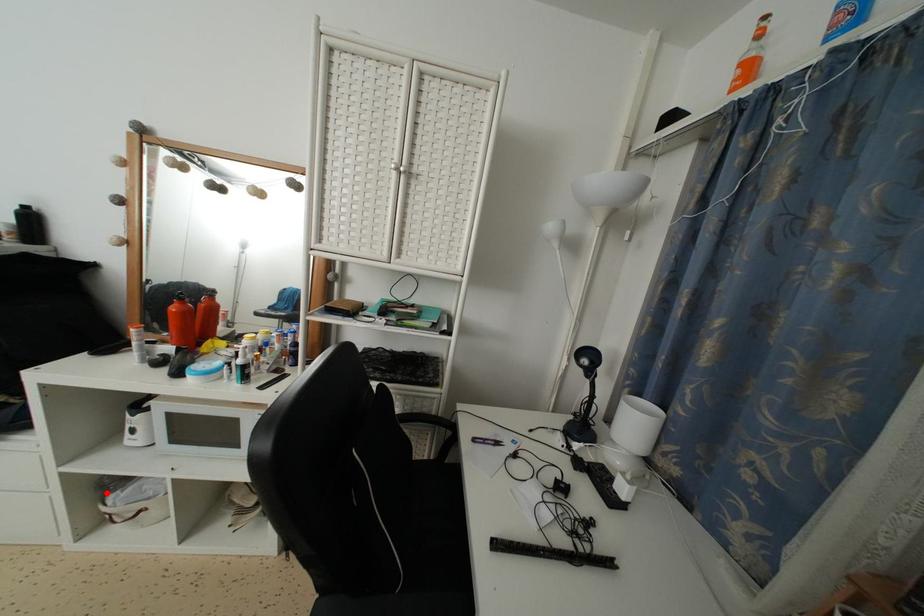
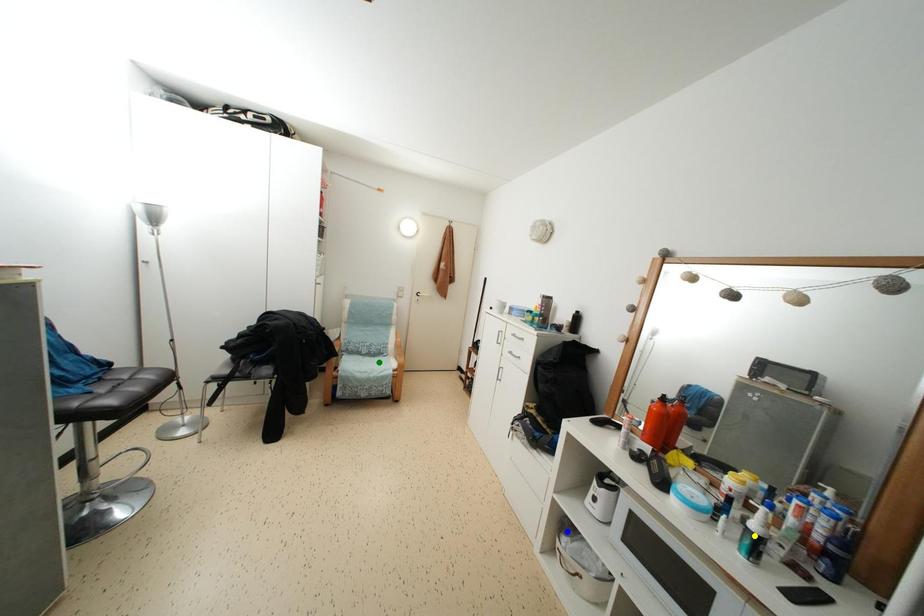
Question: I am providing you with two images of the same scene from different viewpoints. A red point is marked on the first image. You are given multiple points on the second image. Which mark in image 2 goes with the point in image 1?

Choices:
 (A) green point
 (B) blue point
 (C) yellow point

Answer: (B)